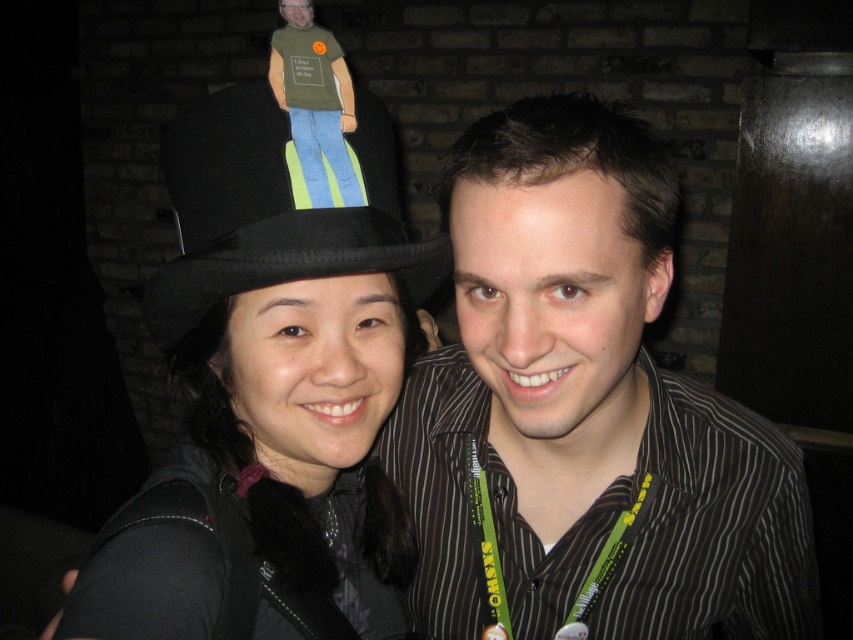
You are trying to identify the position of the black felt hat at upper left in the image. According to the coordinates provided, where exactly is it located?

The black felt hat at upper left is located at point (270, 396).

You are a photographer trying to adjust the lighting for a portrait. You notice two black felt hats at the upper left of the image. Which hat is closer to the camera, the black felt hat at upper left or the black felt fedora at upper left?

The black felt hat at upper left is positioned under the black felt fedora at upper left, so the fedora is closer to the camera.

You are a photographer trying to adjust the lighting for a photo shoot. You notice two black felt hats at the upper left of the frame. Which one is closer to the camera, the black felt hat at upper left or the black felt fedora at upper left?

The black felt hat at upper left is closer to the camera than the black felt fedora at upper left because the black felt fedora at upper left is behind it.